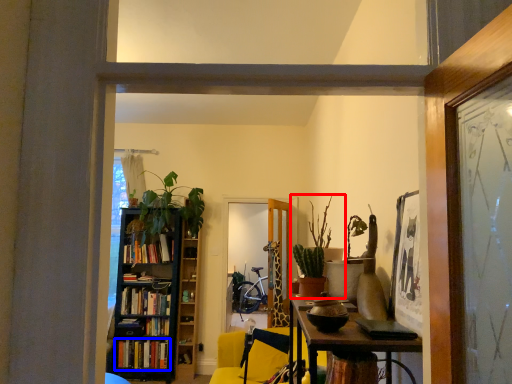
Question: Which object appears farthest to the camera in this image, houseplant (highlighted by a red box) or book (highlighted by a blue box)?

Choices:
 (A) houseplant
 (B) book

Answer: (B)